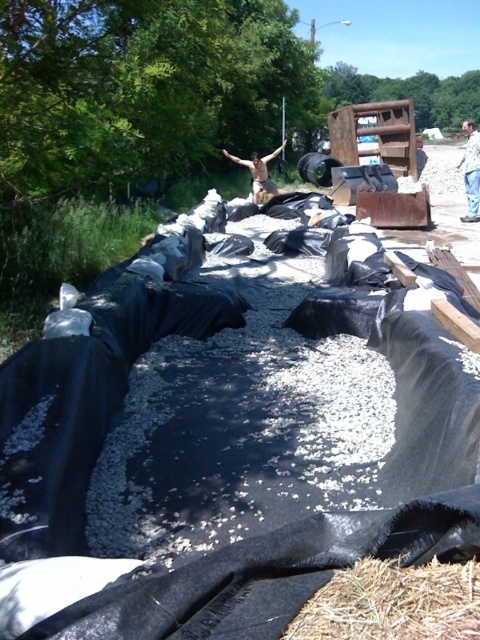
You are a construction worker standing at the center of the image. You need to place a new tool at the exact location where the brown dry hay at lower right is currently located. According to the coordinates provided, where should you place the tool?

The brown dry hay at lower right is located at coordinates point (394, 604), so you should place the tool at that exact point.

You are a landscape designer assessing the construction site. You notice the brown dry hay at lower right and the skinny man at center. Which object occupies more space in the scene?

The skinny man at center occupies more space in the scene than the brown dry hay at lower right since the brown dry hay at lower right is smaller than the skinny man at center.

You are organizing materials for a landscaping project and need to know which item takes up more space. Based on the scene, which occupies more area between the brown dry hay at lower right and the tan fabric shirt at center?

The tan fabric shirt at center occupies more space than the brown dry hay at lower right.